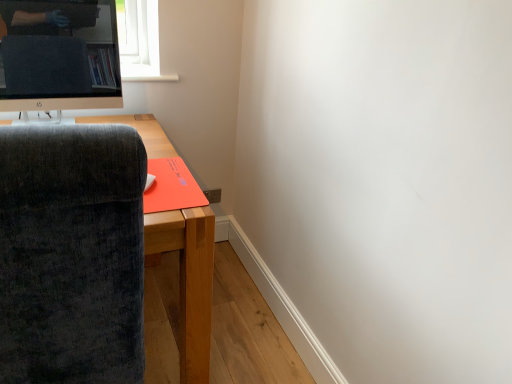
Locate an element on the screen. The width and height of the screenshot is (512, 384). free spot above orange matte mousepad at lower left (from a real-world perspective) is located at coordinates 167,180.